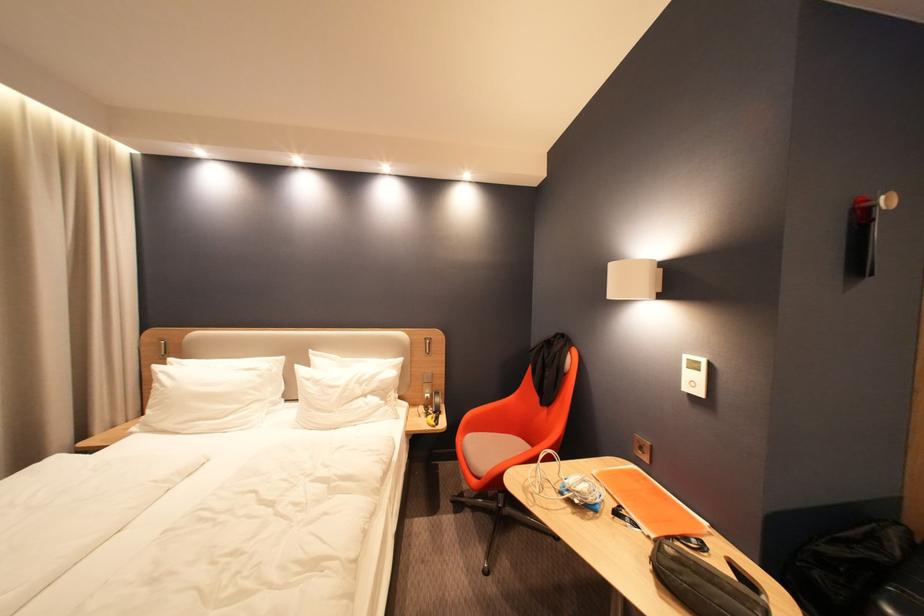
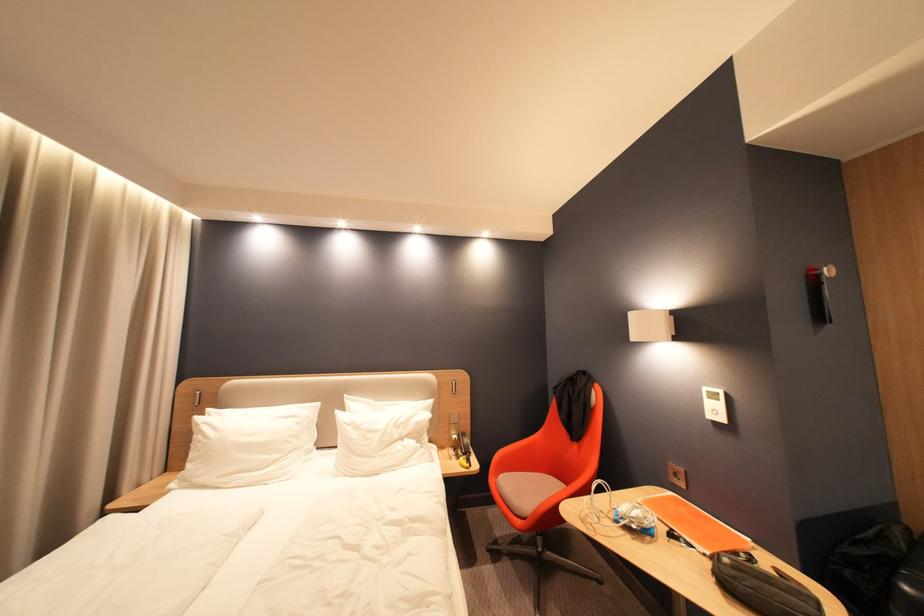
Locate, in the second image, the point that corresponds to the point at 412,359 in the first image.

(443, 400)